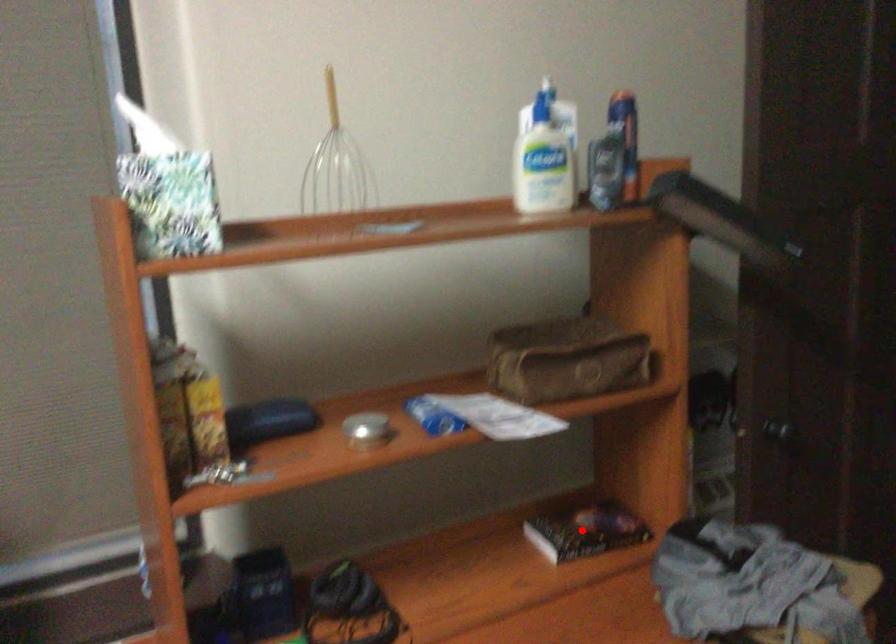
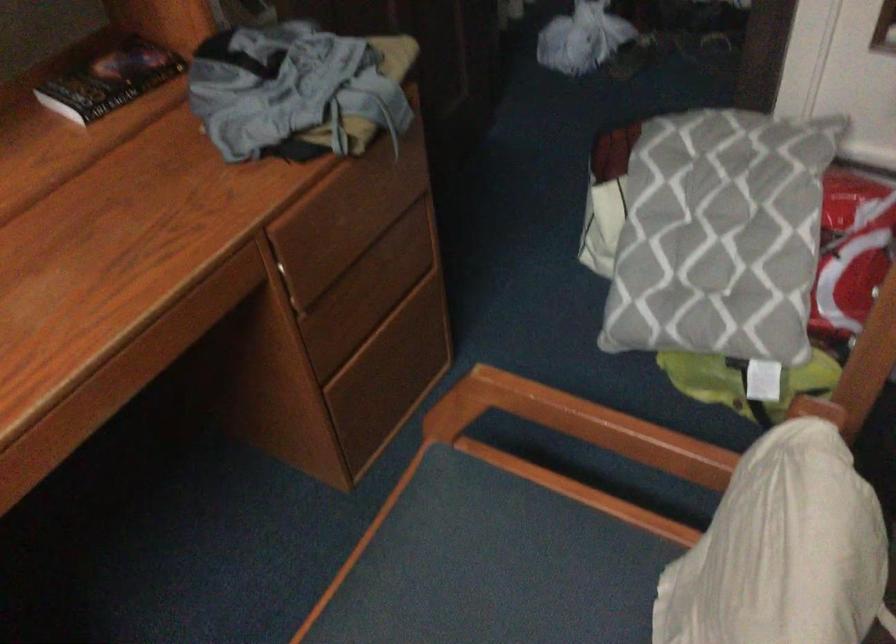
Question: I am providing you with two images of the same scene from different viewpoints. Image1 has a red point marked. In image2, the corresponding 3D location appears at what relative position? Reply with the corresponding letter.

Choices:
 (A) Closer
 (B) Farther

Answer: (A)